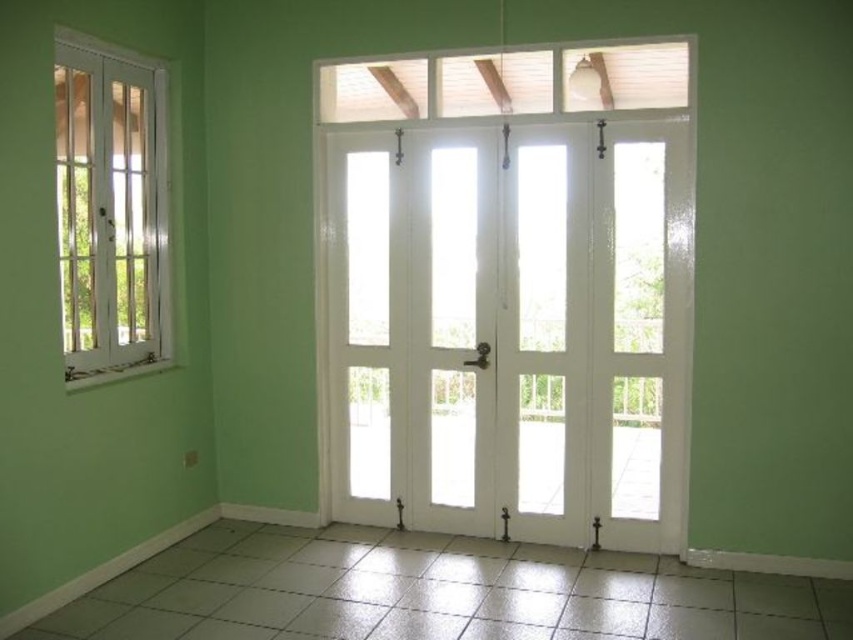
Between white glass door at center and white glass window at left, which one has less height?

white glass window at left

Is white glass door at center shorter than white glass window at left?

No, white glass door at center is not shorter than white glass window at left.

Where is `white glass door at center`? The height and width of the screenshot is (640, 853). white glass door at center is located at coordinates (509, 332).